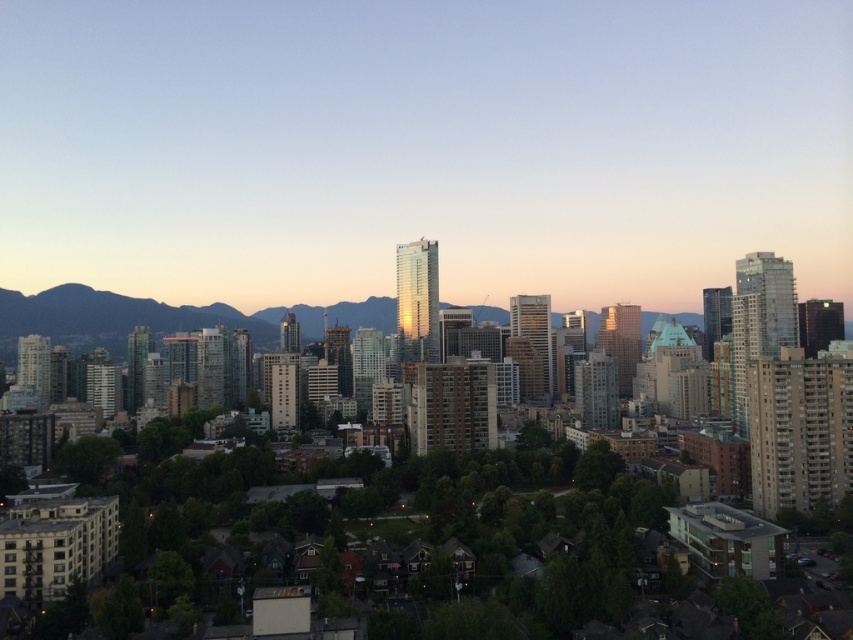
You are a drone operator trying to capture a photo of the matte glass skyscraper at center. Your drone is currently at position coordinates of point 0.150, 0.350. In which direction should you move the drone to align it with the skyscraper?

The matte glass skyscraper at center is located at point (422, 147). Since the drone is at (298, 96), it needs to move northeast to reach the skyscraper.

You are a drone operator trying to navigate between the matte glass skyscraper at center and the rocky brown mountain at center. According to the scene, which object is located to the right of the other?

The matte glass skyscraper at center is positioned on the right side of the rocky brown mountain at center, so the skyscraper is to the right of the mountain.

You are a drone operator who needs to fly a drone between the matte glass skyscraper at center and the rocky brown mountain at center. The drone has a maximum flight distance of 300 feet. Can the drone safely make this flight without exceeding its range?

The distance between the matte glass skyscraper at center and the rocky brown mountain at center is 320.05 feet, which exceeds the drone operator maximum flight distance of 300 feet. The drone cannot safely make this flight without exceeding its range.